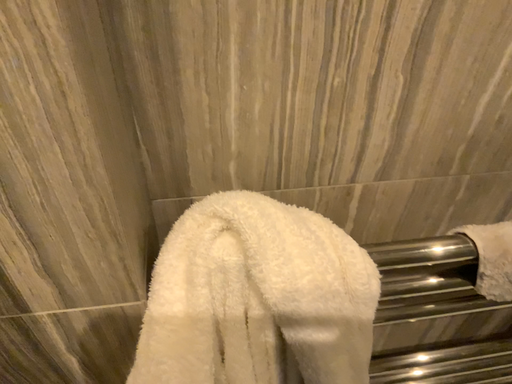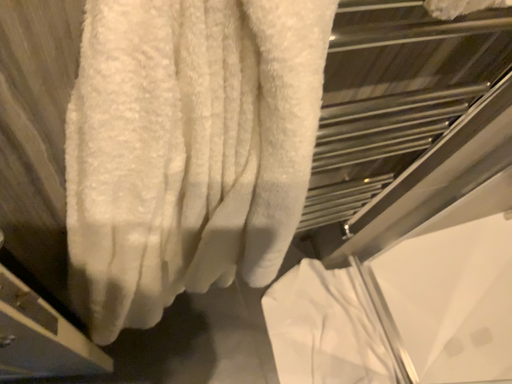
Question: How did the camera likely rotate when shooting the video?

Choices:
 (A) rotated upward
 (B) rotated downward

Answer: (B)